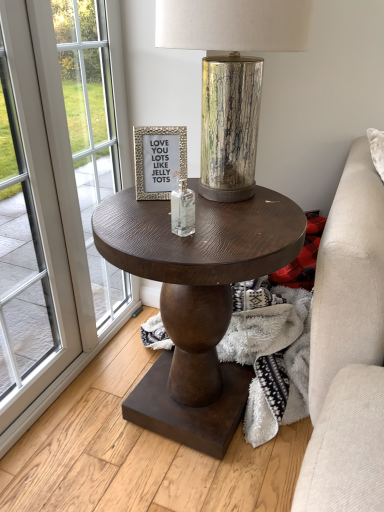
Locate an element on the screen. This screenshot has height=512, width=384. free space in front of clear glass bottle at center is located at coordinates click(183, 248).